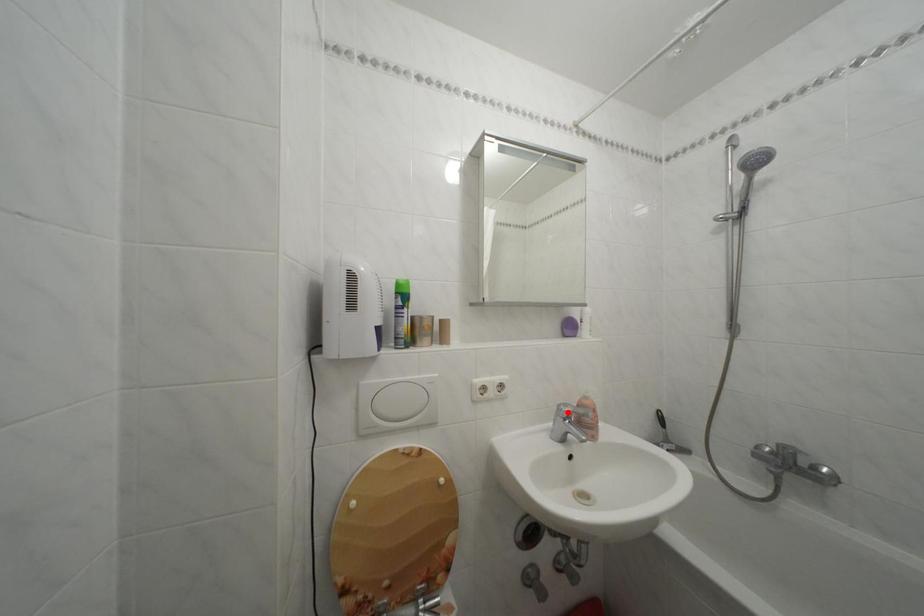
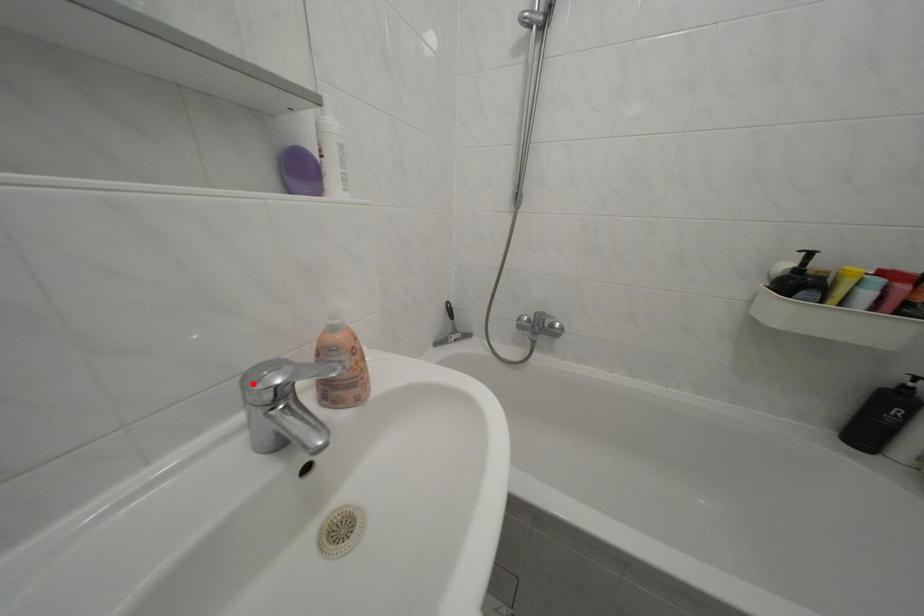
I am providing you with two images of the same scene from different viewpoints. A red point is marked on the first image and another point is marked on the second image. Does the point marked in image1 correspond to the same location as the one in image2?

Yes